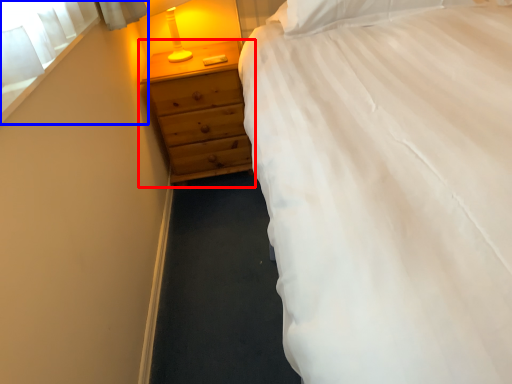
Question: Among these objects, which one is nearest to the camera, chest of drawers (highlighted by a red box) or window screen (highlighted by a blue box)?

Choices:
 (A) chest of drawers
 (B) window screen

Answer: (B)